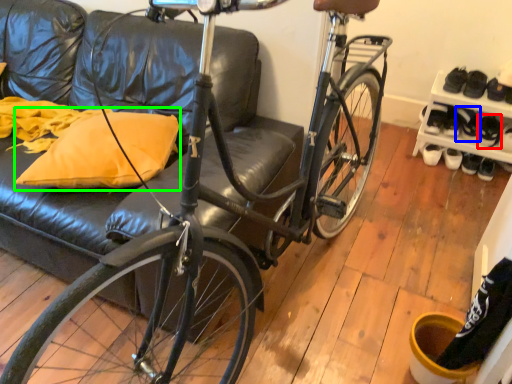
Question: Which object is the farthest from shoe (highlighted by a red box)? Choose among these: shoe (highlighted by a blue box) or throw pillow (highlighted by a green box).

Choices:
 (A) shoe
 (B) throw pillow

Answer: (B)